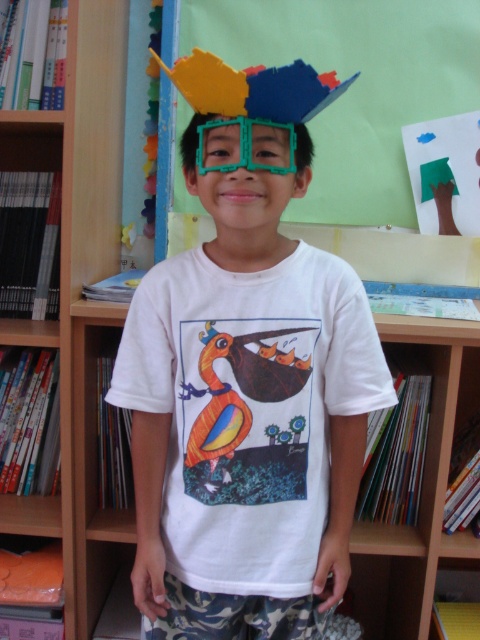
You are an interior designer planning to hang a new decorative item between the matte plastic mask at center and the matte cardboard bulletin board at upper center. Based on their positions, where should you place the new item to maintain symmetry?

To maintain symmetry between the matte plastic mask at center and the matte cardboard bulletin board at upper center, the new item should be placed midway between them along the vertical axis, ensuring it is centered between their positions.

The boy is wearing a matte plastic mask at center and green plastic glasses at center. Which one has a greater height?

The matte plastic mask at center is taller than the green plastic glasses at center.